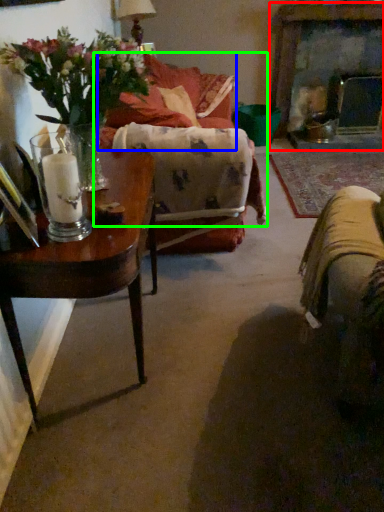
Question: Based on their relative distances, which object is farther from fireplace (highlighted by a red box)? Choose from couch (highlighted by a blue box) and couch (highlighted by a green box).

Choices:
 (A) couch
 (B) couch

Answer: (B)